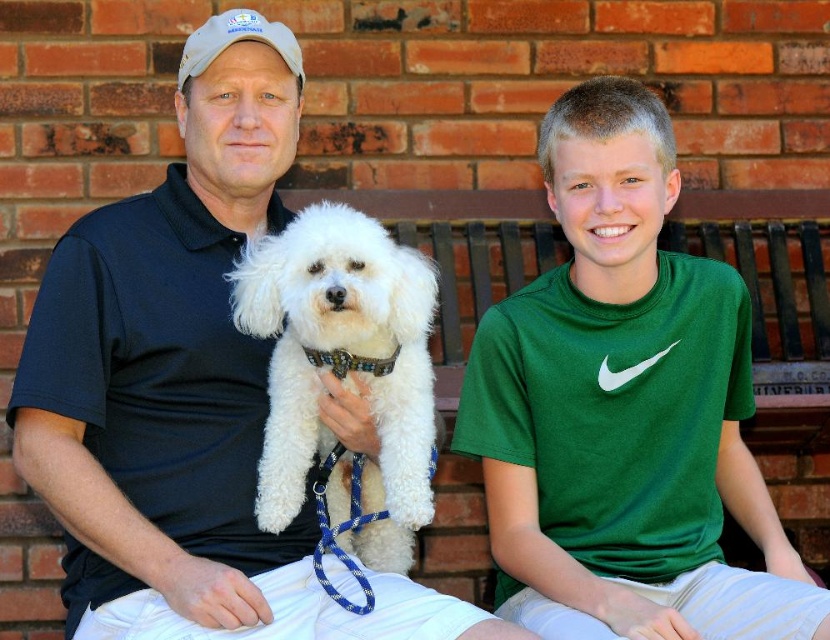
Is point (66, 461) behind point (340, 492)?

No.

Looking at this image, is matte black shirt at center to the left of white fluffy dog at center from the viewer's perspective?

Indeed, matte black shirt at center is positioned on the left side of white fluffy dog at center.

Describe the element at coordinates (184, 387) in the screenshot. Image resolution: width=830 pixels, height=640 pixels. I see `matte black shirt at center` at that location.

Where is `matte black shirt at center`? The width and height of the screenshot is (830, 640). matte black shirt at center is located at coordinates (184, 387).

The height and width of the screenshot is (640, 830). Find the location of `green cotton shirt at center`. green cotton shirt at center is located at coordinates (623, 410).

Consider the image. Does green cotton shirt at center have a lesser height compared to white fluffy dog at center?

Incorrect, green cotton shirt at center's height does not fall short of white fluffy dog at center's.

Which is behind, point (584, 451) or point (261, 291)?

The point (584, 451) is behind.

Identify the location of green cotton shirt at center. (623, 410).

Does point (220, 330) come in front of point (586, 452)?

That is True.

Does matte black shirt at center lie in front of green cotton shirt at center?

Yes, it is.

Between point (228, 552) and point (536, 556), which one is positioned in front?

Point (228, 552) is in front.

Image resolution: width=830 pixels, height=640 pixels. Find the location of `matte black shirt at center`. matte black shirt at center is located at coordinates (184, 387).